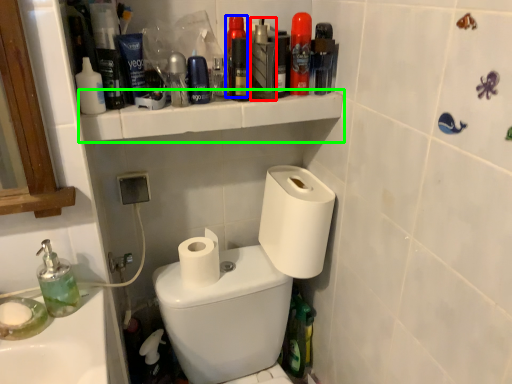
Question: Based on their relative distances, which object is nearer to mouthwash (highlighted by a red box)? Choose from mouthwash (highlighted by a blue box) and shelve (highlighted by a green box).

Choices:
 (A) mouthwash
 (B) shelve

Answer: (A)